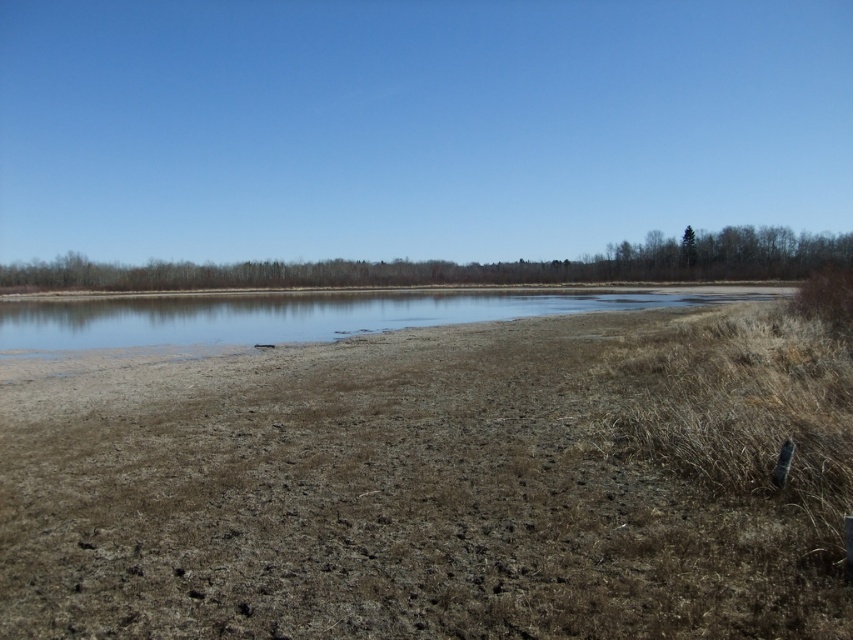
The image size is (853, 640). What do you see at coordinates (436, 484) in the screenshot?
I see `brown dry grass at center` at bounding box center [436, 484].

Between point (364, 403) and point (140, 301), which one is positioned in front?

Point (364, 403) is in front.

In order to click on brown dry grass at center in this screenshot , I will do `click(436, 484)`.